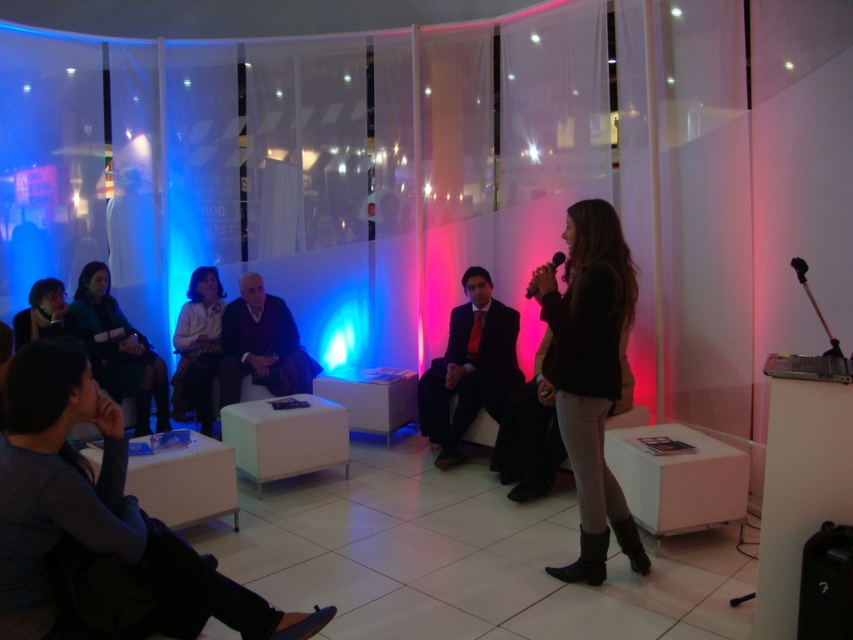
Question: Which point is farther to the camera?

Choices:
 (A) black leather jacket at center
 (B) white knit sweater at center

Answer: (B)

Question: Which point is closer to the camera?

Choices:
 (A) (585, 497)
 (B) (183, 346)

Answer: (A)

Question: Where is matte green jacket at center located in relation to white knit sweater at center in the image?

Choices:
 (A) below
 (B) above

Answer: (B)

Question: Estimate the real-world distances between objects in this image. Which object is closer to the black leather jacket at center?

Choices:
 (A) matte green jacket at center
 (B) white knit sweater at center

Answer: (B)

Question: Does matte green jacket at center have a larger size compared to white knit sweater at center?

Choices:
 (A) yes
 (B) no

Answer: (A)

Question: Does black leather jacket at center have a greater width compared to white knit sweater at center?

Choices:
 (A) no
 (B) yes

Answer: (B)